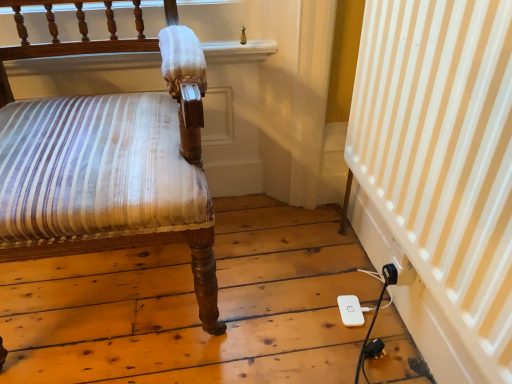
You are a GUI agent. You are given a task and a screenshot of the screen. Output one action in this format:
    pyautogui.click(x=<x>, y=<y>)
    Task: Click on the vacant space in front of white plastic ipod at lower right
    The image size is (512, 384).
    Given the screenshot: What is the action you would take?
    pyautogui.click(x=358, y=350)